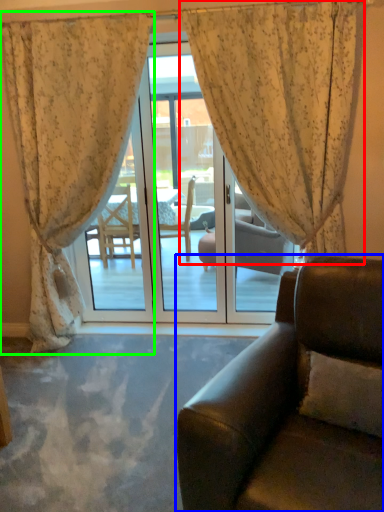
Question: Considering the real-world distances, which object is closest to curtain (highlighted by a red box)? studio couch (highlighted by a blue box) or curtain (highlighted by a green box).

Choices:
 (A) studio couch
 (B) curtain

Answer: (B)